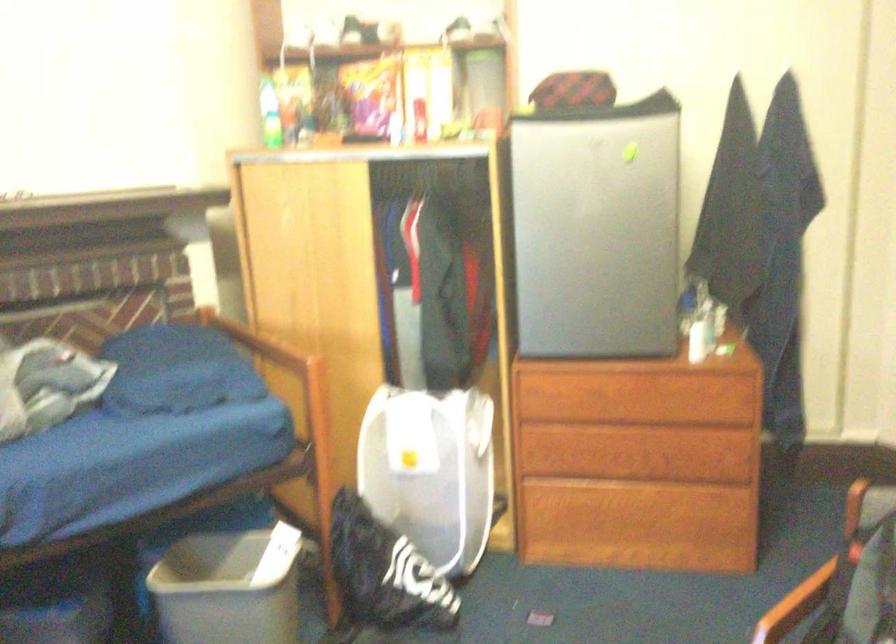
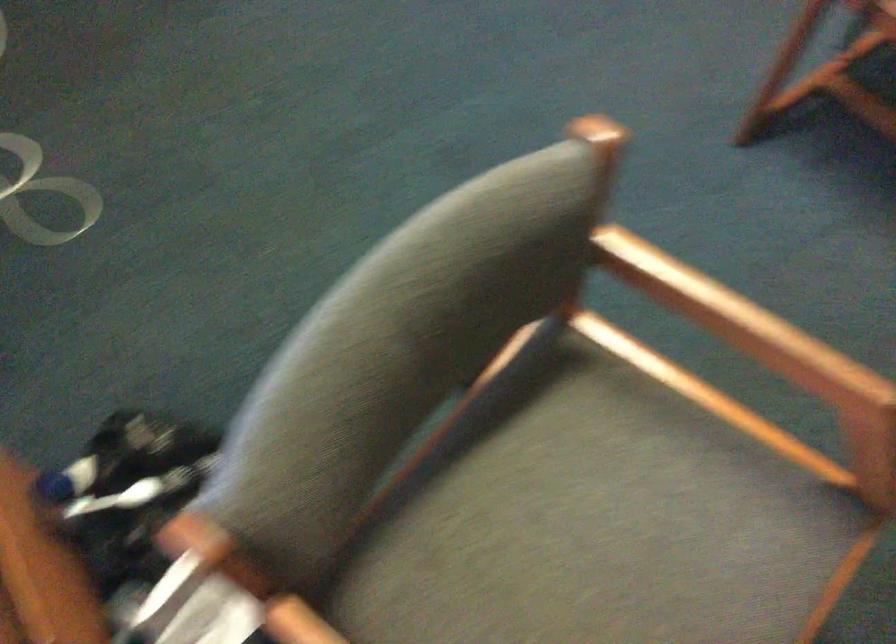
Question: The images are taken continuously from a first-person perspective. In which direction is your viewpoint rotating?

Choices:
 (A) Left
 (B) Right
 (C) Up
 (D) Down

Answer: (D)